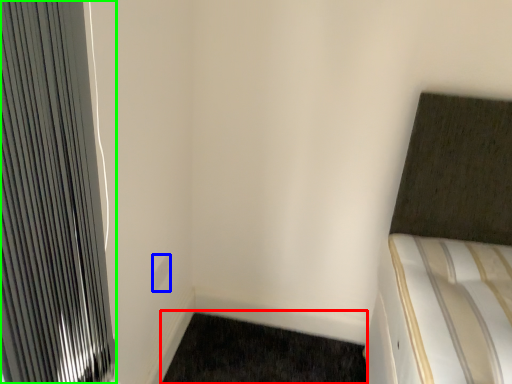
Question: Considering the real-world distances, which object is closest to doormat (highlighted by a red box)? electric outlet (highlighted by a blue box) or radiator (highlighted by a green box).

Choices:
 (A) electric outlet
 (B) radiator

Answer: (A)